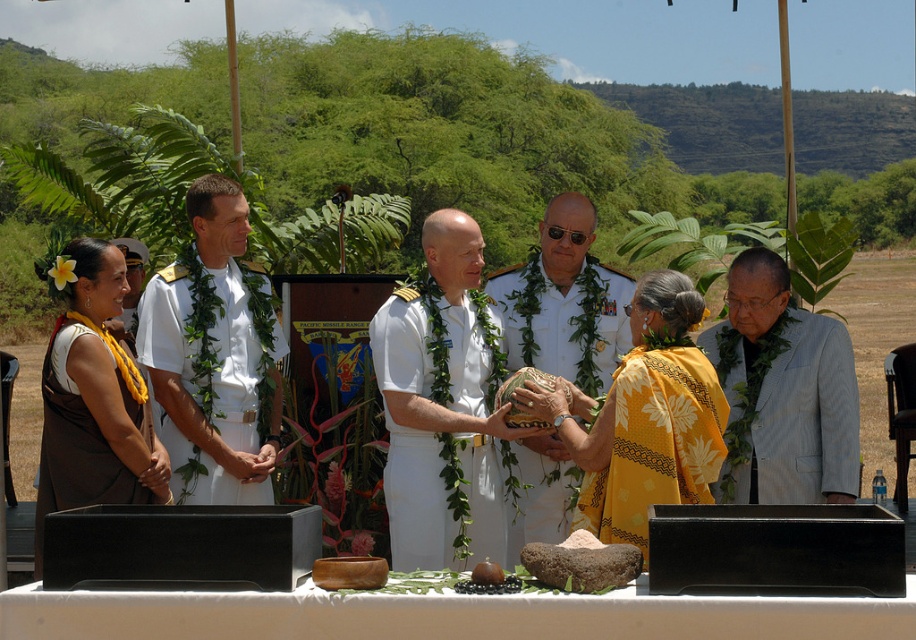
Who is shorter, white matte table at center or smooth brown rock at center?

smooth brown rock at center

Which is in front, point (369, 602) or point (579, 570)?

Point (369, 602)

Locate an element on the screen. This screenshot has width=916, height=640. white matte table at center is located at coordinates (445, 614).

Does yellow printed fabric at center have a lesser height compared to brown fabric robe at lower left?

Yes.

Between point (724, 403) and point (64, 410), which one is positioned behind?

Point (64, 410)

Identify the location of yellow printed fabric at center. The height and width of the screenshot is (640, 916). (655, 442).

Can you confirm if white cotton lei at center is wider than brown fabric robe at lower left?

Yes, white cotton lei at center is wider than brown fabric robe at lower left.

Does point (426, 460) come in front of point (86, 474)?

That is False.

You are a GUI agent. You are given a task and a screenshot of the screen. Output one action in this format:
    pyautogui.click(x=<x>, y=<y>)
    Task: Click on the white cotton lei at center
    Image resolution: width=916 pixels, height=640 pixels.
    Given the screenshot: What is the action you would take?
    pyautogui.click(x=442, y=497)